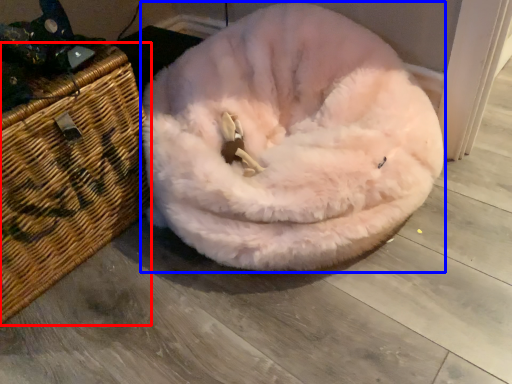
Question: Which of the following is the closest to the observer, basket (highlighted by a red box) or dog bed (highlighted by a blue box)?

Choices:
 (A) basket
 (B) dog bed

Answer: (B)